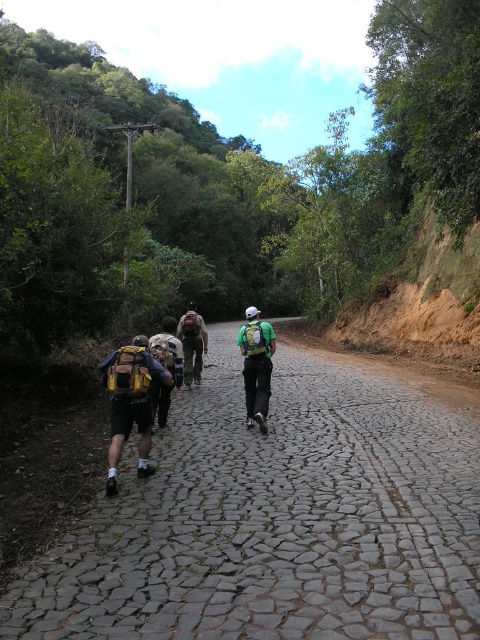
Question: Which point is closer to the camera taking this photo?

Choices:
 (A) (200, 358)
 (B) (134, 376)

Answer: (B)

Question: Is matte yellow backpack at center wider than camouflage fabric backpack at center?

Choices:
 (A) no
 (B) yes

Answer: (A)

Question: Which of these objects is positioned closest to the gray cobblestone path at center?

Choices:
 (A) matte yellow backpack at center
 (B) camouflage fabric backpack at center

Answer: (A)

Question: Among these objects, which one is nearest to the camera?

Choices:
 (A) camouflage fabric backpack at center
 (B) matte yellow backpack at center

Answer: (B)

Question: Is gray cobblestone path at center above camouflage fabric backpack at center?

Choices:
 (A) no
 (B) yes

Answer: (A)

Question: Does gray cobblestone path at center appear on the left side of camouflage fabric backpack at center?

Choices:
 (A) yes
 (B) no

Answer: (B)